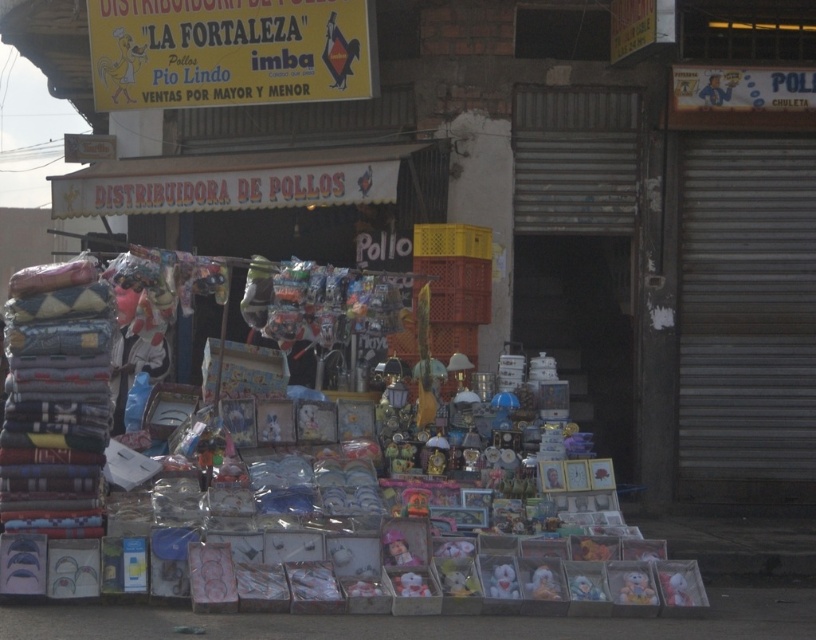
Between plush teddy bear at lower center and soft plush bear at lower right, which one is positioned lower?

plush teddy bear at lower center is lower down.

Does plush teddy bear at lower center appear over soft plush bear at lower right?

Incorrect, plush teddy bear at lower center is not positioned above soft plush bear at lower right.

At what (x,y) coordinates should I click in order to perform the action: click on plush teddy bear at lower center. Please return your answer as a coordinate pair (x, y). Looking at the image, I should click on [637, 589].

Is point (546, 577) farther from viewer compared to point (408, 593)?

Yes, it is behind point (408, 593).

Image resolution: width=816 pixels, height=640 pixels. Identify the location of fluffy plush toy at lower center. (544, 580).

Locate an element on the screen. This screenshot has width=816, height=640. fluffy plush toy at lower center is located at coordinates (544, 580).

In the scene shown: Which of these two, plush pink doll at center or plush toy at center, stands shorter?

plush toy at center

Between plush pink doll at center and plush toy at center, which one has more height?

Standing taller between the two is plush pink doll at center.

Is point (424, 545) behind point (397, 584)?

Yes, point (424, 545) is behind point (397, 584).

The height and width of the screenshot is (640, 816). Identify the location of plush pink doll at center. (401, 548).